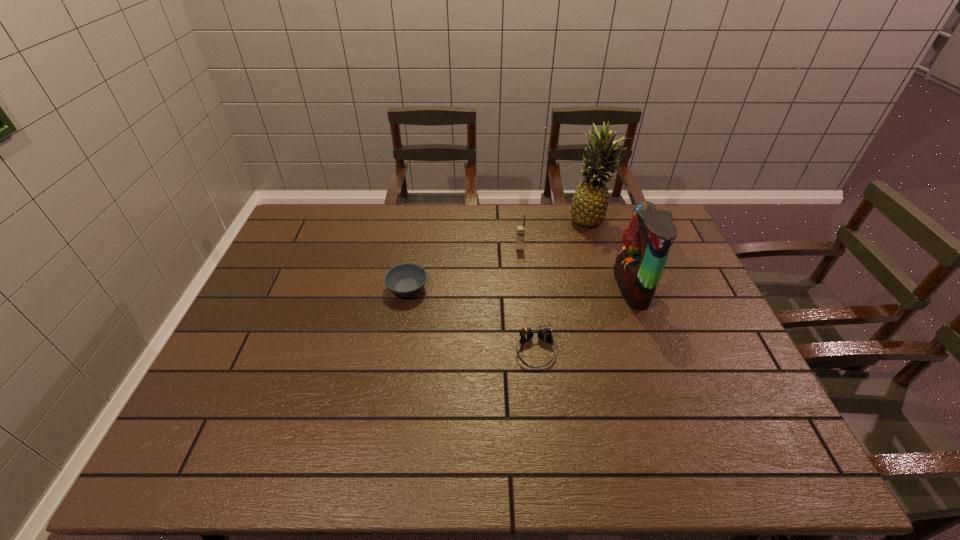
Locate an element on the screen. Image resolution: width=960 pixels, height=540 pixels. free space at the near left corner of the desktop is located at coordinates (215, 443).

The height and width of the screenshot is (540, 960). In the image, there is a desktop. Find the location of `vacant space at the far right corner`. vacant space at the far right corner is located at coordinates pyautogui.click(x=619, y=213).

Identify the location of blank region between the parrot and the goggles. This screenshot has width=960, height=540. [x=584, y=319].

Where is `vacant point located between the leftmost object and the tallest object`? vacant point located between the leftmost object and the tallest object is located at coordinates (499, 253).

I want to click on empty location between the farthest object and the goggles, so click(x=563, y=285).

The height and width of the screenshot is (540, 960). Find the location of `vacant area that lies between the cellular telephone and the parrot`. vacant area that lies between the cellular telephone and the parrot is located at coordinates (576, 268).

Locate an element on the screen. vacant region between the cellular telephone and the pineapple is located at coordinates (555, 233).

At what (x,y) coordinates should I click in order to perform the action: click on vacant space that is in between the pineapple and the third shortest object. Please return your answer as a coordinate pair (x, y). The height and width of the screenshot is (540, 960). Looking at the image, I should click on (555, 233).

Where is `vacant area between the tallest object and the fourth shortest object`? This screenshot has height=540, width=960. vacant area between the tallest object and the fourth shortest object is located at coordinates (612, 253).

Locate an element on the screen. free space between the parrot and the cellular telephone is located at coordinates (576, 268).